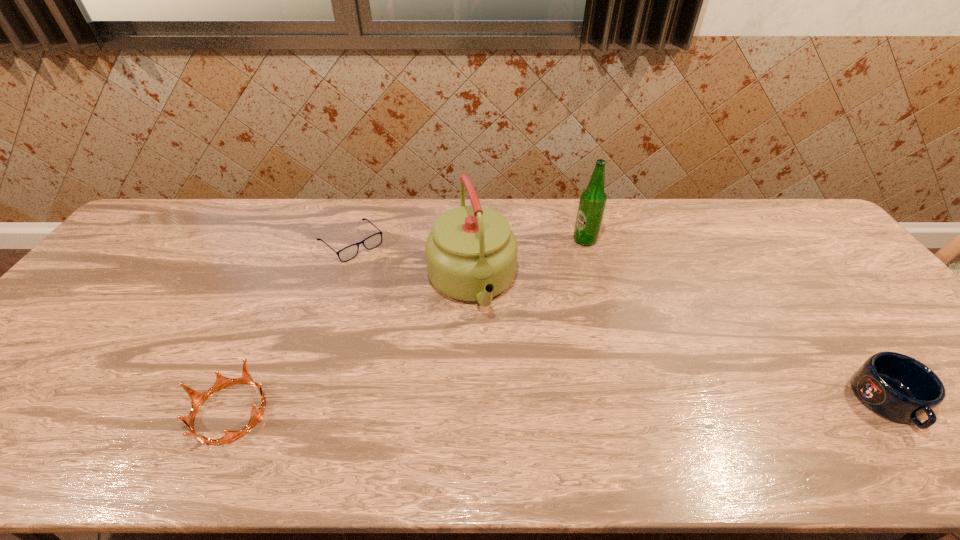
Where is `crown`? This screenshot has height=540, width=960. crown is located at coordinates (198, 398).

The width and height of the screenshot is (960, 540). I want to click on the rightmost object, so click(895, 386).

Identify the location of the third object from left to right. (471, 253).

At what (x,y) coordinates should I click in order to perform the action: click on spectacles. Please return your answer as a coordinate pair (x, y). This screenshot has height=540, width=960. Looking at the image, I should click on (373, 241).

Locate an element on the screen. beer bottle is located at coordinates (592, 203).

Identify the location of vacant region located 0.390m on the left of the crown. (12, 413).

Locate an element on the screen. This screenshot has height=540, width=960. vacant space located 0.070m at the spout of the third object from left to right is located at coordinates (490, 347).

This screenshot has height=540, width=960. Find the location of `vacant space situated 0.220m at the spout of the third object from left to right`. vacant space situated 0.220m at the spout of the third object from left to right is located at coordinates (507, 399).

In order to click on vacant space situated at the spout of the third object from left to right in this screenshot , I will do `click(514, 419)`.

At what (x,y) coordinates should I click in order to perform the action: click on vacant space located 0.170m on the front-facing side of the shortest object. Please return your answer as a coordinate pair (x, y). This screenshot has width=960, height=540. Looking at the image, I should click on (399, 289).